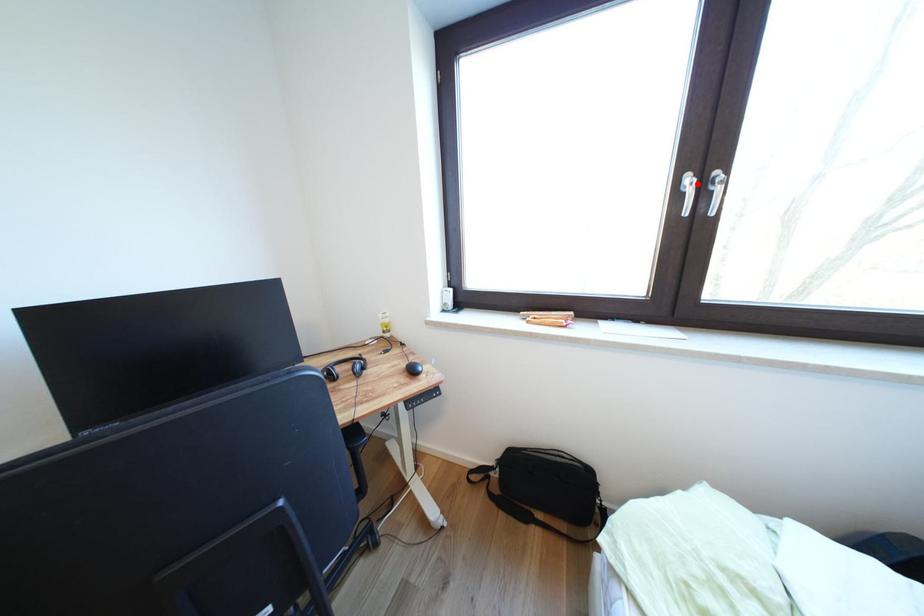
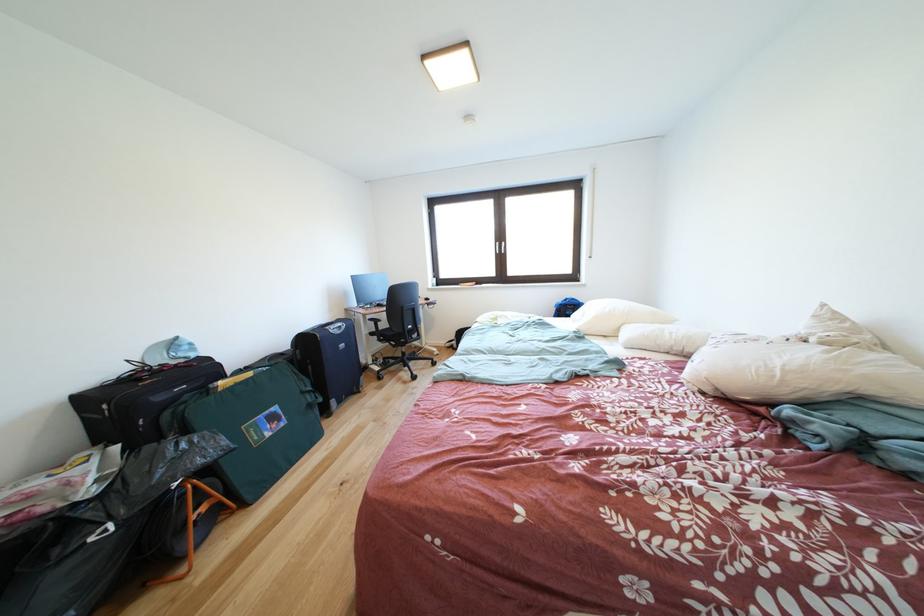
Find the pixel in the second image that matches the highlighted location in the first image.

(505, 249)